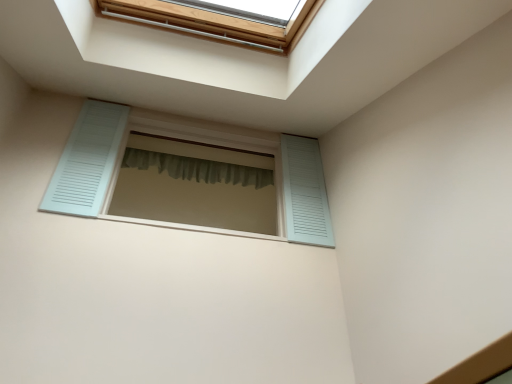
Question: Should I look upward or downward to see green fabric shower curtain at center?

Choices:
 (A) up
 (B) down

Answer: (A)

Question: From the image's perspective, would you say light blue wooden shutters at center is shown under green fabric shower curtain at center?

Choices:
 (A) yes
 (B) no

Answer: (A)

Question: From a real-world perspective, is light blue wooden shutters at center positioned over green fabric shower curtain at center based on gravity?

Choices:
 (A) yes
 (B) no

Answer: (B)

Question: Could green fabric shower curtain at center be considered to be inside light blue wooden shutters at center?

Choices:
 (A) yes
 (B) no

Answer: (B)

Question: Considering the relative sizes of light blue wooden shutters at center and green fabric shower curtain at center in the image provided, is light blue wooden shutters at center taller than green fabric shower curtain at center?

Choices:
 (A) yes
 (B) no

Answer: (A)

Question: From the image's perspective, would you say light blue wooden shutters at center is positioned over green fabric shower curtain at center?

Choices:
 (A) yes
 (B) no

Answer: (B)

Question: Considering the relative positions of light blue wooden shutters at center and green fabric shower curtain at center in the image provided, is light blue wooden shutters at center to the left of green fabric shower curtain at center from the viewer's perspective?

Choices:
 (A) no
 (B) yes

Answer: (A)

Question: From a real-world perspective, is green fabric shower curtain at center under light blue wooden shutters at center?

Choices:
 (A) no
 (B) yes

Answer: (A)

Question: From the image's perspective, is green fabric shower curtain at center on light blue wooden shutters at center?

Choices:
 (A) yes
 (B) no

Answer: (A)

Question: Is green fabric shower curtain at center taller than light blue wooden shutters at center?

Choices:
 (A) no
 (B) yes

Answer: (A)

Question: Does green fabric shower curtain at center appear on the left side of light blue wooden shutters at center?

Choices:
 (A) no
 (B) yes

Answer: (B)

Question: Is green fabric shower curtain at center positioned far away from light blue wooden shutters at center?

Choices:
 (A) no
 (B) yes

Answer: (A)

Question: Does green fabric shower curtain at center have a greater width compared to light blue wooden shutters at center?

Choices:
 (A) no
 (B) yes

Answer: (A)

Question: Looking at their shapes, would you say green fabric shower curtain at center is wider or thinner than light blue wooden shutters at center?

Choices:
 (A) wide
 (B) thin

Answer: (B)